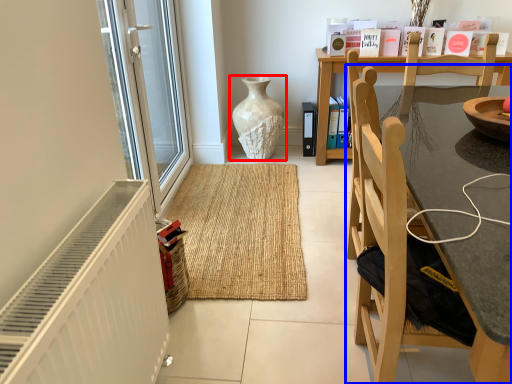
Question: Which of the following is the closest to the observer, vase (highlighted by a red box) or chair (highlighted by a blue box)?

Choices:
 (A) vase
 (B) chair

Answer: (B)